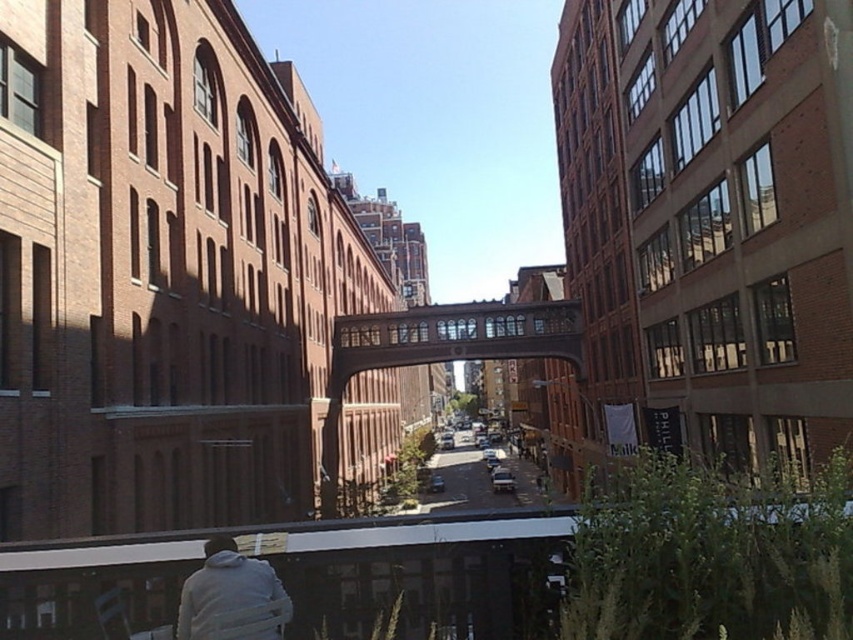
Question: Does light gray hoodie at lower left have a smaller size compared to smooth asphalt road at center?

Choices:
 (A) no
 (B) yes

Answer: (B)

Question: Among these points, which one is nearest to the camera?

Choices:
 (A) (236, 595)
 (B) (445, 508)

Answer: (A)

Question: Which point is closer to the camera?

Choices:
 (A) smooth asphalt road at center
 (B) light gray hoodie at lower left

Answer: (B)

Question: Is light gray hoodie at lower left further to camera compared to smooth asphalt road at center?

Choices:
 (A) yes
 (B) no

Answer: (B)

Question: Which point is farther to the camera?

Choices:
 (A) (241, 592)
 (B) (456, 493)

Answer: (B)

Question: Is light gray hoodie at lower left wider than smooth asphalt road at center?

Choices:
 (A) yes
 (B) no

Answer: (B)